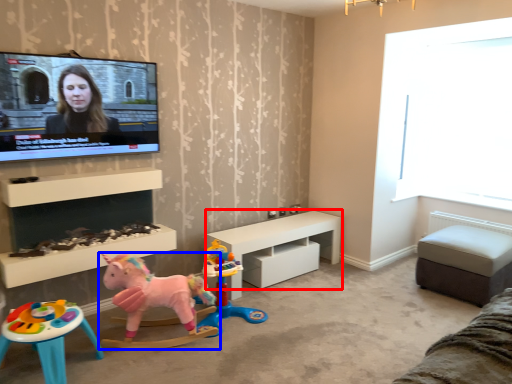
Question: Which object is further to the camera taking this photo, table (highlighted by a red box) or toy (highlighted by a blue box)?

Choices:
 (A) table
 (B) toy

Answer: (A)